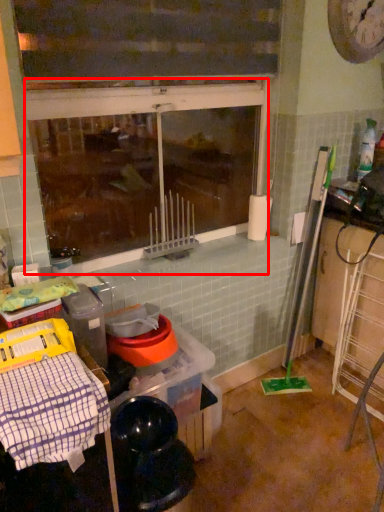
Question: From the image's perspective, where is window (annotated by the red box) located in relation to blanket in the image?

Choices:
 (A) above
 (B) below

Answer: (A)